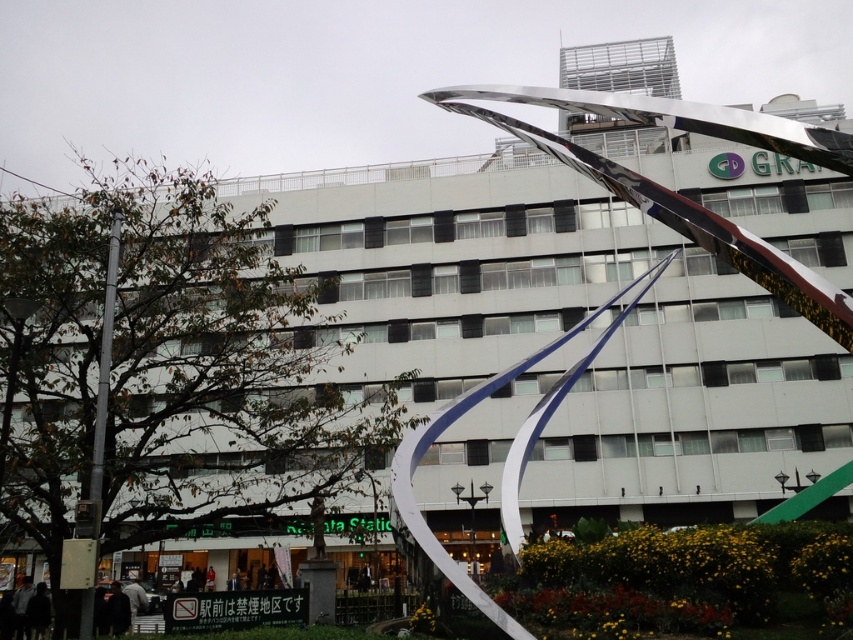
Based on the photo, you are a delivery person approaching the building and see the silver metallic pole at left and the dark fabric jacket at lower left. Which object is closer to the entrance of the building?

The dark fabric jacket at lower left is closer to the entrance of the building because it is positioned to the left of the silver metallic pole at left, which is further to the right.

You are a delivery person who needs to place a package between the silver metallic pole at left and the red ribbon sculpture at right. The package requires a minimum of 40 feet of space to be placed safely. Can you safely place the package between them?

The silver metallic pole at left and the red ribbon sculpture at right are 44.57 feet apart, which is more than the required 40 feet, so yes, the package can be safely placed between them.